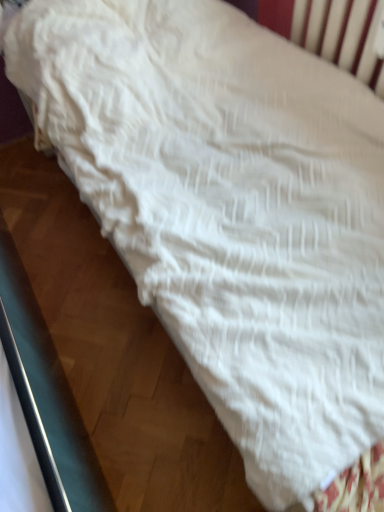
This screenshot has height=512, width=384. Describe the element at coordinates (342, 35) in the screenshot. I see `white textured radiator at upper right` at that location.

Where is `white textured radiator at upper right`? The height and width of the screenshot is (512, 384). white textured radiator at upper right is located at coordinates (342, 35).

Where is `white textured radiator at upper right`? This screenshot has width=384, height=512. white textured radiator at upper right is located at coordinates (342, 35).